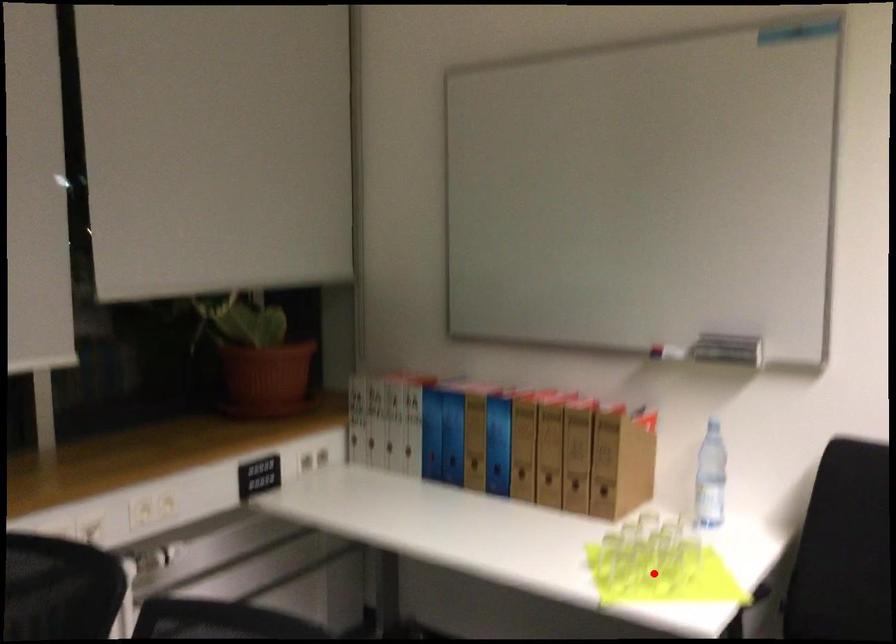
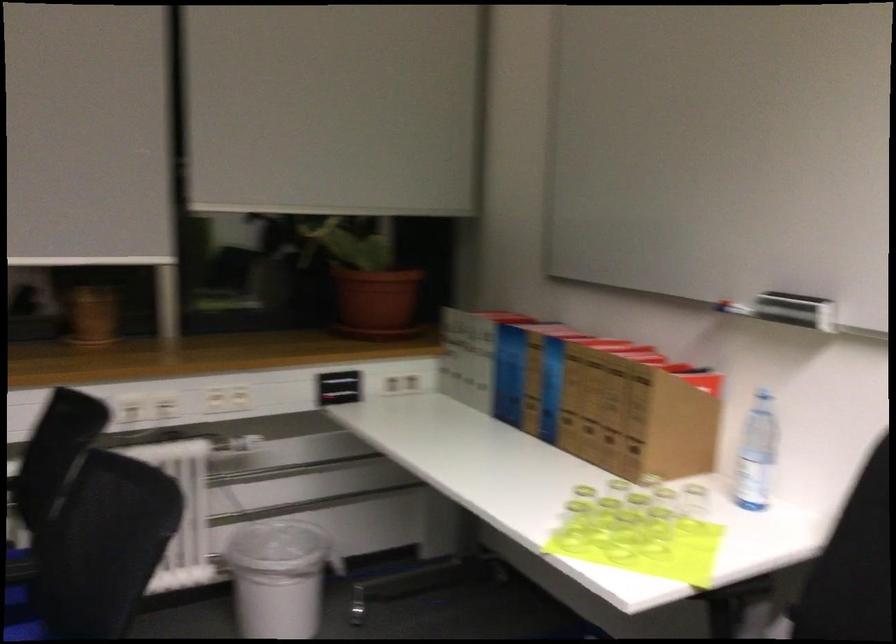
Where in the second image is the point corresponding to the highlighted location from the first image?

(623, 536)